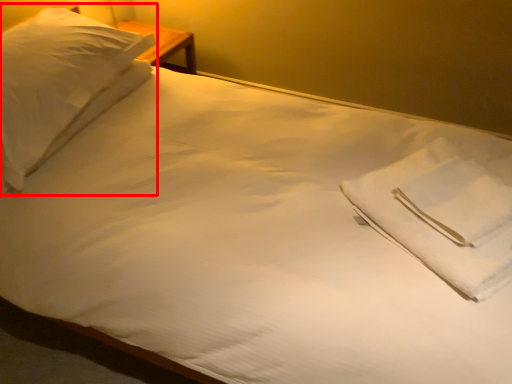
Question: In this image, where is pillow (annotated by the red box) located relative to cloth?

Choices:
 (A) left
 (B) right

Answer: (A)